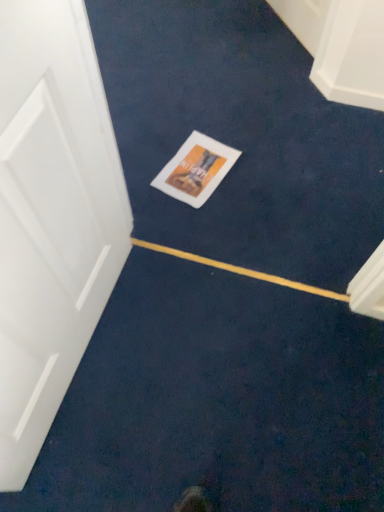
Where is `empty space that is ontop of white matte postcard at center (from a real-world perspective)`? Image resolution: width=384 pixels, height=512 pixels. empty space that is ontop of white matte postcard at center (from a real-world perspective) is located at coordinates (191, 164).